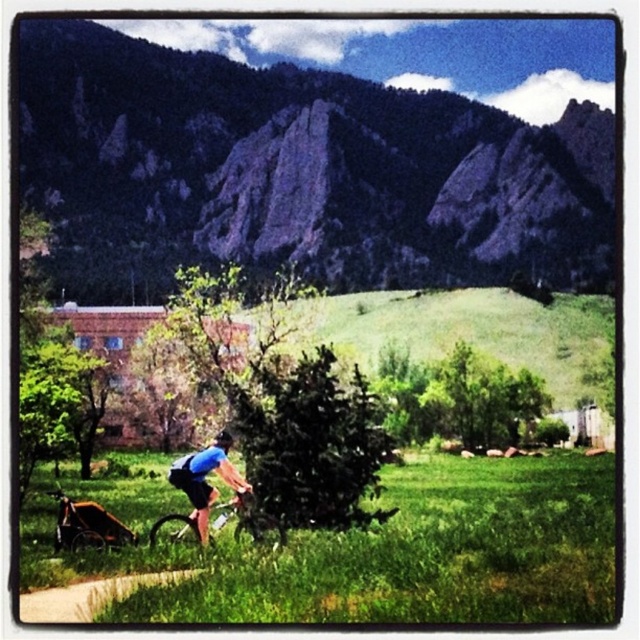
You are a hiker planning to take a photo of the green rock formation at center and the matte black mountain bike at center from a spot where both are visible. Given their distance apart, is there a location in the scene where you can position yourself to capture both in a single frame without moving the camera?

The green rock formation at center and matte black mountain bike at center are 795.46 feet apart. Since the distance between them is quite large, you would need to position yourself at a vantage point far enough back to encompass both into the camera frame, likely near the start of the paved path where the entire scene is visible.

You are standing at the point marked as point (298, 172) in the image. What object is located exactly at your current position?

The green rock formation at center is located exactly at point (298, 172).

You are a hiker who wants to place a small first aid kit between the matte black mountain bike at center and the black matte bicycle helmet at center. The first aid kit requires 1 meter of space. Is there enough space between them to place it?

The distance between the matte black mountain bike at center and the black matte bicycle helmet at center is 8.23 meters, so yes, there is enough space to place the first aid kit between them since it only requires 1 meter.